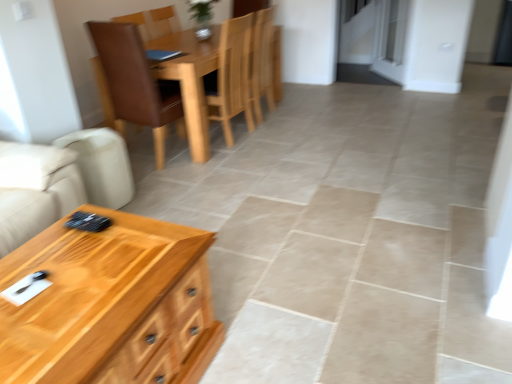
Question: Is wooden coffee table at lower left further to the viewer compared to brown leather chair at upper center, which is counted as the 2th chair, starting from the right?

Choices:
 (A) yes
 (B) no

Answer: (B)

Question: From the image's perspective, does wooden coffee table at lower left appear lower than brown leather chair at upper center, marked as the first chair in a left-to-right arrangement?

Choices:
 (A) no
 (B) yes

Answer: (B)

Question: Can you confirm if wooden coffee table at lower left is shorter than brown leather chair at upper center, marked as the first chair in a left-to-right arrangement?

Choices:
 (A) yes
 (B) no

Answer: (A)

Question: Can you confirm if wooden coffee table at lower left is thinner than brown leather chair at upper center, marked as the first chair in a left-to-right arrangement?

Choices:
 (A) no
 (B) yes

Answer: (B)

Question: Can you confirm if wooden coffee table at lower left is bigger than brown leather chair at upper center, which is counted as the 2th chair, starting from the right?

Choices:
 (A) yes
 (B) no

Answer: (B)

Question: Is there a large distance between wooden coffee table at lower left and brown leather chair at upper center, marked as the first chair in a left-to-right arrangement?

Choices:
 (A) yes
 (B) no

Answer: (A)

Question: Can we say wooden chair at center, the second chair in the left-to-right sequence, lies outside wooden coffee table at lower left?

Choices:
 (A) yes
 (B) no

Answer: (A)

Question: From the image's perspective, is wooden chair at center, positioned as the first chair in right-to-left order, on wooden coffee table at lower left?

Choices:
 (A) no
 (B) yes

Answer: (B)

Question: Is there a large distance between wooden chair at center, positioned as the first chair in right-to-left order, and wooden coffee table at lower left?

Choices:
 (A) no
 (B) yes

Answer: (B)

Question: Is wooden chair at center, positioned as the first chair in right-to-left order, aimed at wooden coffee table at lower left?

Choices:
 (A) yes
 (B) no

Answer: (B)

Question: Considering the relative sizes of wooden chair at center, positioned as the first chair in right-to-left order, and wooden coffee table at lower left in the image provided, is wooden chair at center, positioned as the first chair in right-to-left order, taller than wooden coffee table at lower left?

Choices:
 (A) no
 (B) yes

Answer: (B)

Question: Does wooden chair at center, positioned as the first chair in right-to-left order, appear on the right side of wooden coffee table at lower left?

Choices:
 (A) yes
 (B) no

Answer: (A)

Question: From the image's perspective, is brown leather chair at upper center, marked as the first chair in a left-to-right arrangement, located above wooden chair at center, positioned as the first chair in right-to-left order?

Choices:
 (A) yes
 (B) no

Answer: (B)